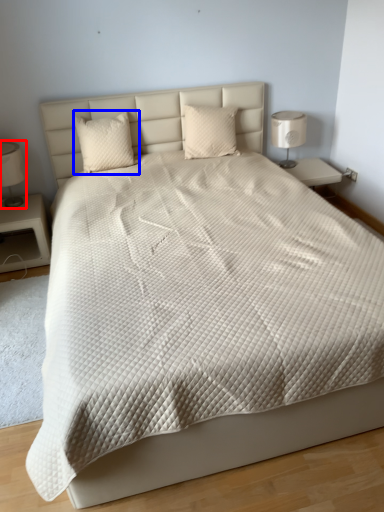
Question: Which object is closer to the camera taking this photo, bedside lamp (highlighted by a red box) or pillow (highlighted by a blue box)?

Choices:
 (A) bedside lamp
 (B) pillow

Answer: (A)